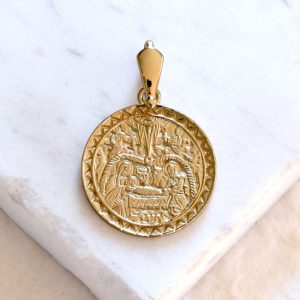
The width and height of the screenshot is (300, 300). I want to click on counter, so click(x=244, y=130).